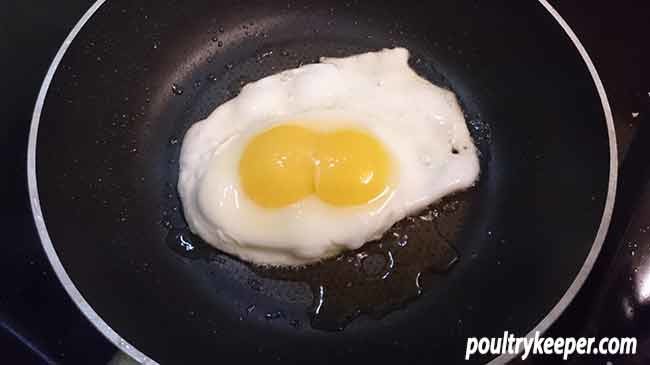
I want to click on stove top, so pyautogui.click(x=47, y=308).